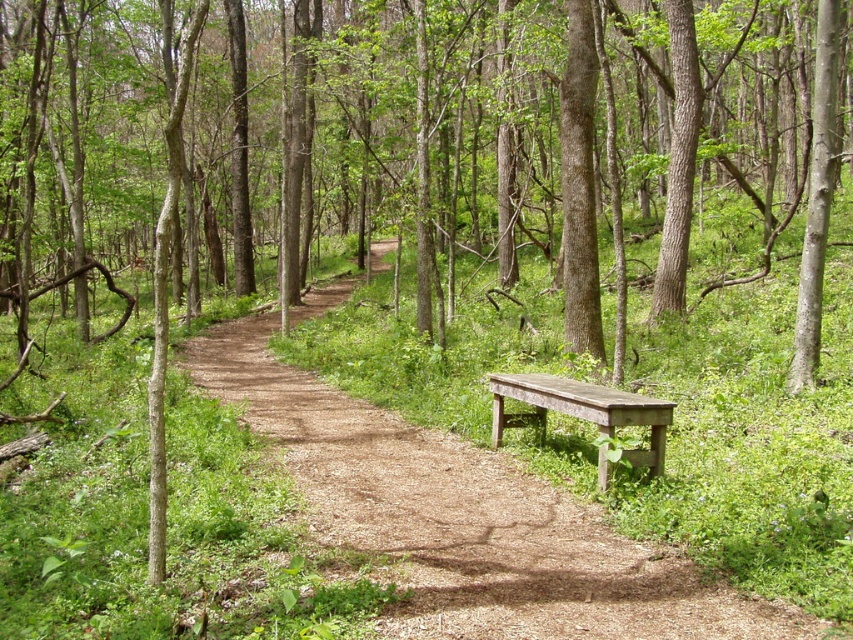
Question: Which object is farther from the camera taking this photo?

Choices:
 (A) wooden bench at right
 (B) weathered wood bench at right

Answer: (B)

Question: Can you confirm if wooden bench at right is positioned to the right of weathered wood bench at right?

Choices:
 (A) no
 (B) yes

Answer: (A)

Question: Which point is farther to the camera?

Choices:
 (A) weathered wood bench at right
 (B) wooden bench at right

Answer: (A)

Question: Can you confirm if wooden bench at right is positioned to the left of weathered wood bench at right?

Choices:
 (A) no
 (B) yes

Answer: (B)

Question: In this image, where is wooden bench at right located relative to weathered wood bench at right?

Choices:
 (A) right
 (B) left

Answer: (B)